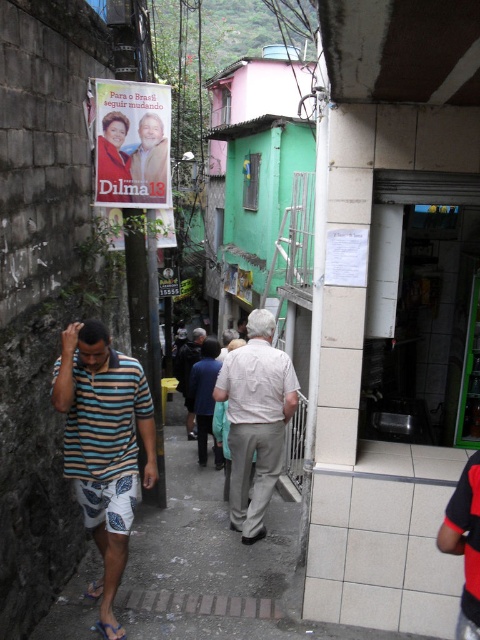
Can you confirm if brick pavement at center is positioned to the left of matte paper poster at upper left?

No, brick pavement at center is not to the left of matte paper poster at upper left.

Does brick pavement at center have a larger size compared to matte paper poster at upper left?

Yes, brick pavement at center is bigger than matte paper poster at upper left.

Does point (179, 515) come closer to viewer compared to point (117, 128)?

No, it is behind (117, 128).

Locate an element on the screen. This screenshot has width=480, height=640. brick pavement at center is located at coordinates (216, 568).

Is brick pavement at center shorter than dark blue fabric jacket at center?

Correct, brick pavement at center is not as tall as dark blue fabric jacket at center.

Who is more forward, (170, 516) or (203, 330)?

Point (170, 516) is more forward.

Find the location of a particular element. Image resolution: width=480 pixels, height=640 pixels. brick pavement at center is located at coordinates click(x=216, y=568).

In the scene shown: Who is positioned more to the right, striped cotton shirt at left or dark blue fabric jacket at center?

From the viewer's perspective, striped cotton shirt at left appears more on the right side.

Can you confirm if striped cotton shirt at left is thinner than dark blue fabric jacket at center?

No.

Between point (132, 396) and point (188, 362), which one is positioned behind?

The point (188, 362) is behind.

The width and height of the screenshot is (480, 640). In order to click on striped cotton shirt at left in this screenshot , I will do `click(104, 440)`.